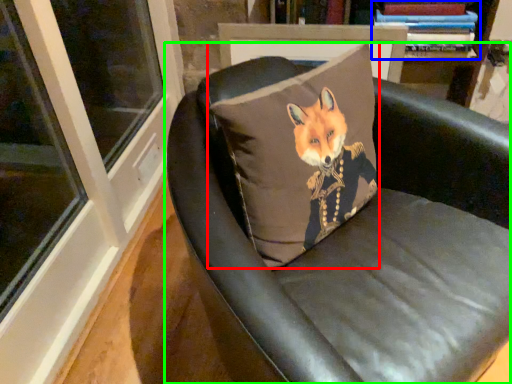
Question: Estimate the real-world distances between objects in this image. Which object is farther from pillow (highlighted by a red box), book (highlighted by a blue box) or chair (highlighted by a green box)?

Choices:
 (A) book
 (B) chair

Answer: (A)